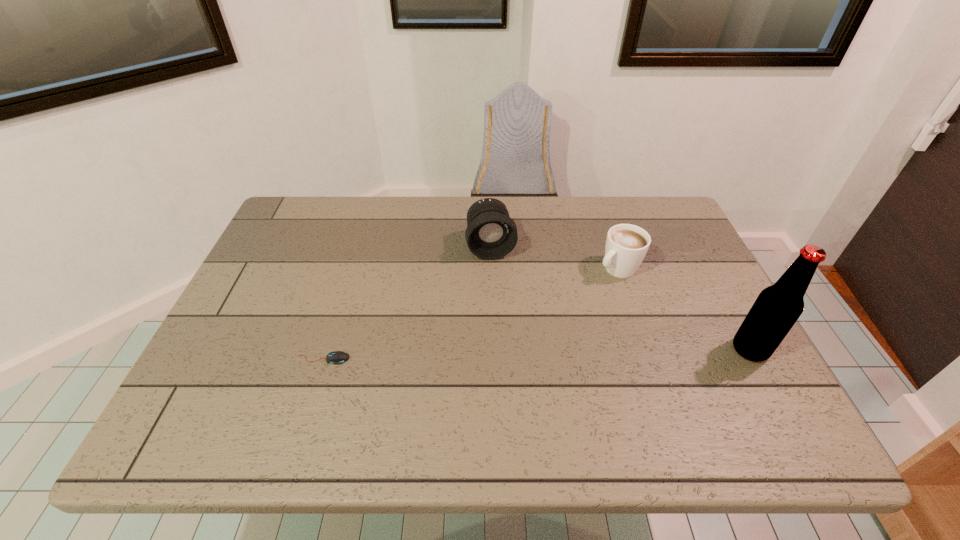
This screenshot has height=540, width=960. I want to click on empty space between the shortest object and the second object from right to left, so click(470, 314).

The height and width of the screenshot is (540, 960). I want to click on free spot between the third object from right to left and the leftmost object, so click(x=407, y=302).

You are a GUI agent. You are given a task and a screenshot of the screen. Output one action in this format:
    pyautogui.click(x=<x>, y=<y>)
    Task: Click on the free space between the telephoto lens and the beer bottle
    This screenshot has width=960, height=540.
    Given the screenshot: What is the action you would take?
    pyautogui.click(x=620, y=298)

I want to click on vacant area that lies between the third shortest object and the cappuccino, so click(x=554, y=257).

Image resolution: width=960 pixels, height=540 pixels. What are the coordinates of `the third closest object to the mouse` in the screenshot? It's located at (777, 308).

Choose which object is the third nearest neighbor to the third object from left to right. Please provide its 2D coordinates. Your answer should be formatted as a tuple, i.e. [(x, y)], where the tuple contains the x and y coordinates of a point satisfying the conditions above.

[(336, 357)]

In order to click on vacant space that satisfies the following two spatial constraints: 1. on the front side of the tallest object; 2. on the right side of the third shortest object in this screenshot , I will do `click(493, 350)`.

You are a GUI agent. You are given a task and a screenshot of the screen. Output one action in this format:
    pyautogui.click(x=<x>, y=<y>)
    Task: Click on the free space in the image that satisfies the following two spatial constraints: 1. on the front side of the telephoto lens; 2. on the right side of the cappuccino
    This screenshot has width=960, height=540.
    Given the screenshot: What is the action you would take?
    pyautogui.click(x=492, y=268)

Image resolution: width=960 pixels, height=540 pixels. What are the coordinates of `vacant space that satisfies the following two spatial constraints: 1. on the front side of the third object from left to right; 2. on the left side of the tallest object` in the screenshot? It's located at (644, 350).